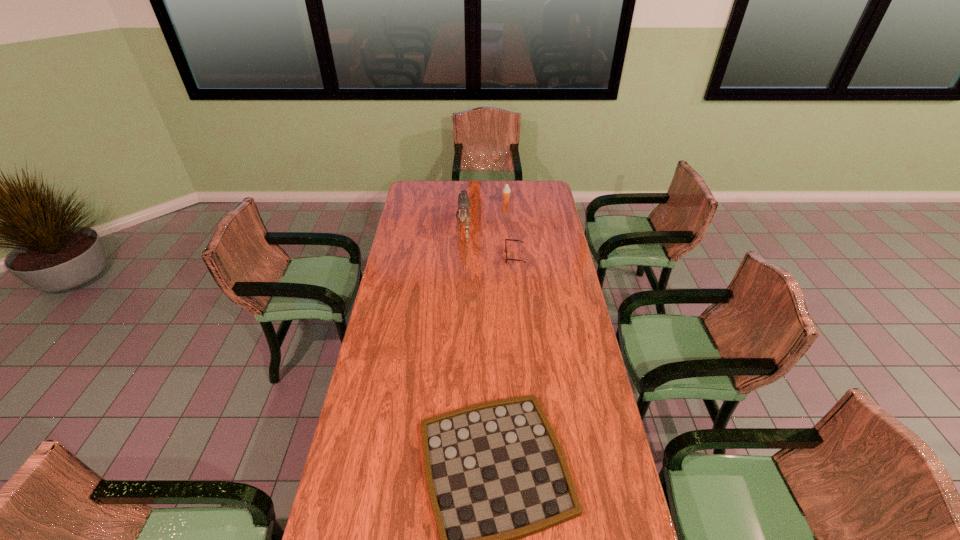
The image size is (960, 540). Find the location of `object that is the third closest to the sunglasses`. object that is the third closest to the sunglasses is located at coordinates (495, 471).

Identify which object is located as the third nearest to the third shortest object. Please provide its 2D coordinates. Your answer should be formatted as a tuple, i.e. [(x, y)], where the tuple contains the x and y coordinates of a point satisfying the conditions above.

[(495, 471)]